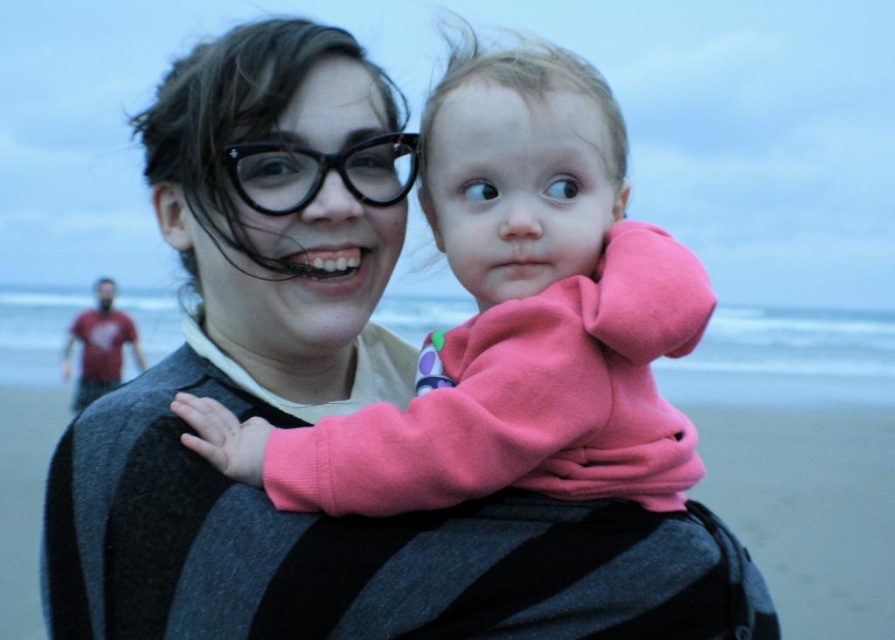
Which is above, matte black sweater at center or pink fleece at center?

Positioned higher is pink fleece at center.

Does matte black sweater at center have a larger size compared to pink fleece at center?

Yes.

Who is more forward, (x=210, y=289) or (x=440, y=145)?

Point (x=440, y=145)

At what (x,y) coordinates should I click in order to perform the action: click on matte black sweater at center. Please return your answer as a coordinate pair (x, y). Image resolution: width=895 pixels, height=640 pixels. Looking at the image, I should click on (237, 365).